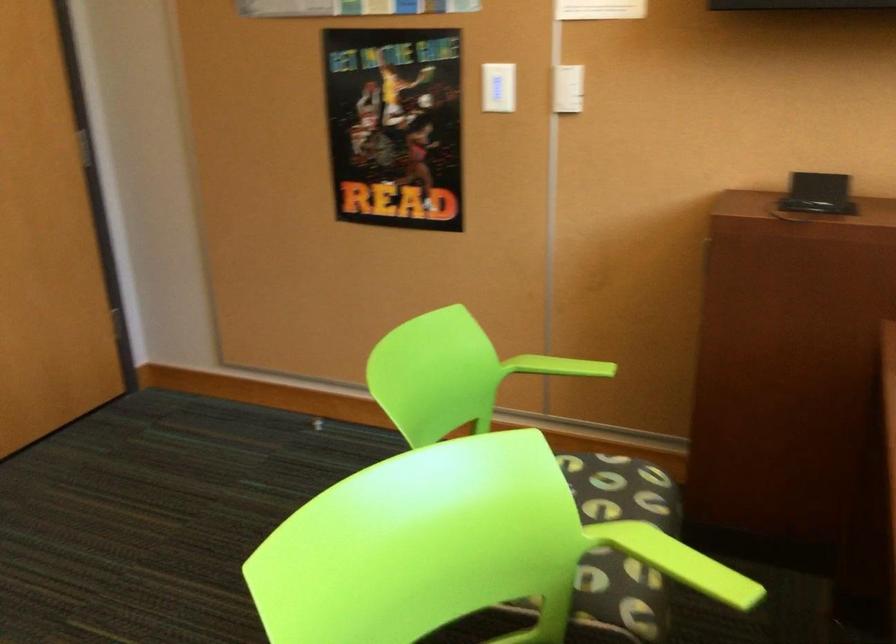
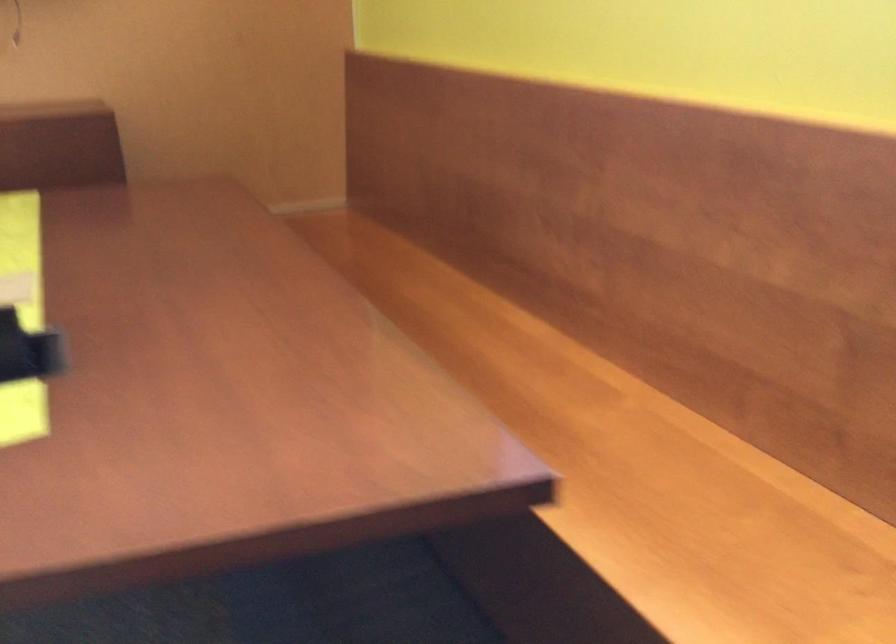
Question: Based on the continuous images, in which direction is the camera rotating? Reply with the corresponding letter.

Choices:
 (A) Left
 (B) Right
 (C) Up
 (D) Down

Answer: (B)